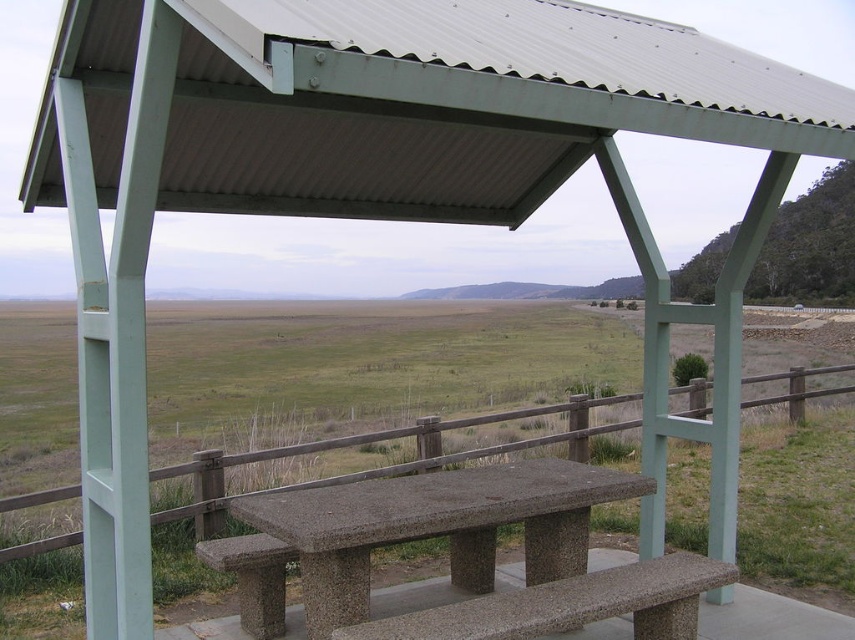
In the scene shown: Can you confirm if granite bench at center is wider than granite bench at lower center?

Correct, the width of granite bench at center exceeds that of granite bench at lower center.

Can you confirm if granite bench at center is positioned below granite bench at lower center?

Incorrect, granite bench at center is not positioned below granite bench at lower center.

Find the location of a particular element. granite bench at center is located at coordinates (569, 604).

Where is `granite bench at center`? The height and width of the screenshot is (640, 855). granite bench at center is located at coordinates (569, 604).

Is concrete bench at center further to the viewer compared to granite bench at center?

Yes, concrete bench at center is further from the viewer.

Does concrete bench at center appear on the right side of granite bench at center?

No, concrete bench at center is not to the right of granite bench at center.

The height and width of the screenshot is (640, 855). I want to click on concrete bench at center, so click(x=435, y=525).

Is concrete bench at center thinner than granite bench at lower center?

No.

Does concrete bench at center have a lesser height compared to granite bench at lower center?

In fact, concrete bench at center may be taller than granite bench at lower center.

Locate an element on the screen. This screenshot has width=855, height=640. concrete bench at center is located at coordinates (435, 525).